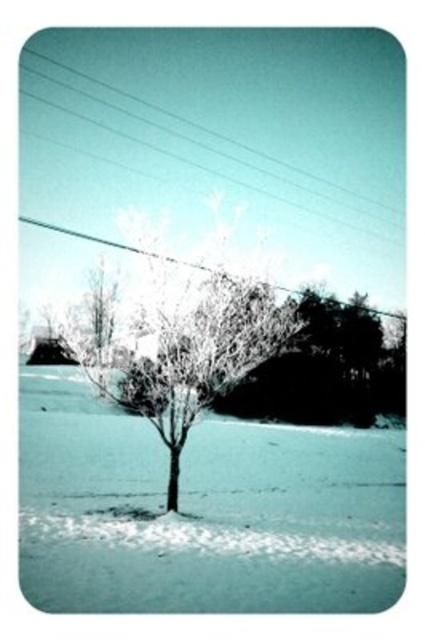
Question: Considering the relative positions of white frosty tree at center and clear plastic power line at upper center in the image provided, where is white frosty tree at center located with respect to clear plastic power line at upper center?

Choices:
 (A) right
 (B) left

Answer: (B)

Question: Can you confirm if white frosty tree at center is positioned below clear plastic power line at upper center?

Choices:
 (A) no
 (B) yes

Answer: (B)

Question: Which of the following is the closest to the observer?

Choices:
 (A) white frosty tree at center
 (B) clear plastic power line at upper center
 (C) metallic wire at upper center

Answer: (A)

Question: Which object is the closest to the white frosty tree at center?

Choices:
 (A) metallic wire at upper center
 (B) clear plastic power line at upper center
 (C) white frosty snow at center

Answer: (C)

Question: Which point is farther to the camera?

Choices:
 (A) metallic wire at upper center
 (B) white frosty tree at center
 (C) clear plastic power line at upper center

Answer: (A)

Question: Can you confirm if white frosty snow at center is bigger than clear plastic power line at upper center?

Choices:
 (A) no
 (B) yes

Answer: (A)